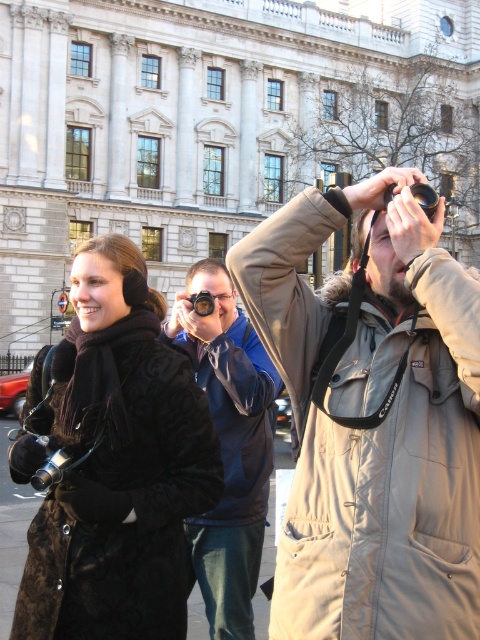
Question: Which point is farther from the camera taking this photo?

Choices:
 (A) (243, 408)
 (B) (134, 364)

Answer: (A)

Question: Can you confirm if tan fabric coat at upper right is thinner than blue fabric jacket at center?

Choices:
 (A) yes
 (B) no

Answer: (B)

Question: Is tan fabric coat at upper right wider than blue fabric jacket at center?

Choices:
 (A) yes
 (B) no

Answer: (A)

Question: Which object is the farthest from the black fur coat at center?

Choices:
 (A) tan fabric coat at upper right
 (B) blue fabric jacket at center

Answer: (A)

Question: Does tan fabric coat at upper right have a larger size compared to blue fabric jacket at center?

Choices:
 (A) no
 (B) yes

Answer: (A)

Question: Which point is farther to the camera?

Choices:
 (A) (297, 480)
 (B) (247, 632)
 (C) (132, 449)

Answer: (B)